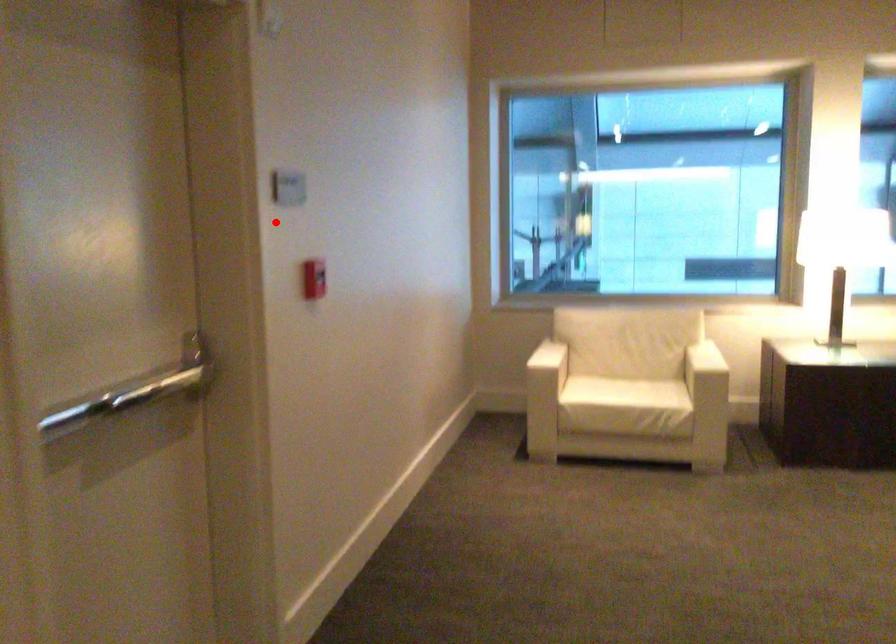
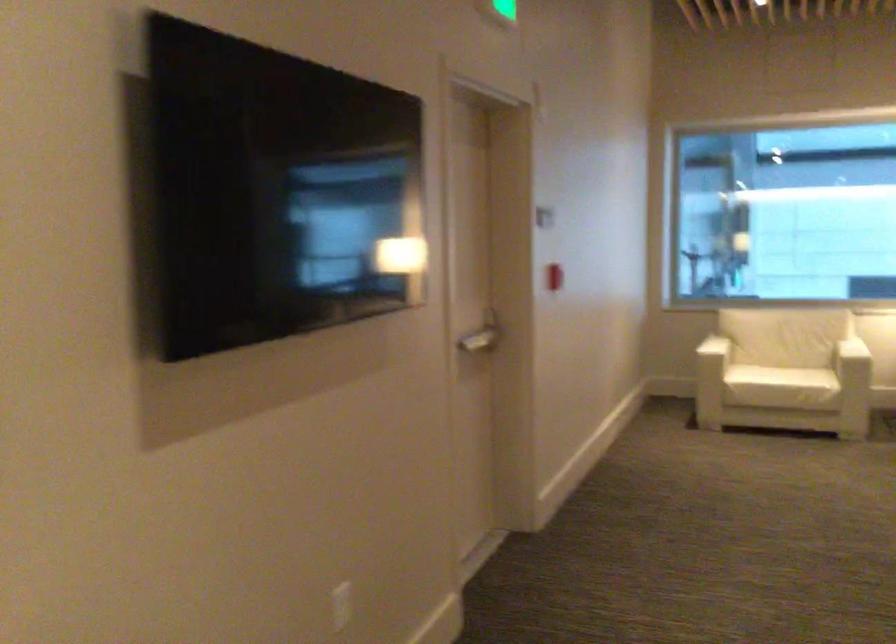
Question: I am providing you with two images of the same scene from different viewpoints. Given a red point in image1, look at the same physical point in image2. Is it:

Choices:
 (A) Closer to the viewpoint
 (B) Farther from the viewpoint

Answer: (B)